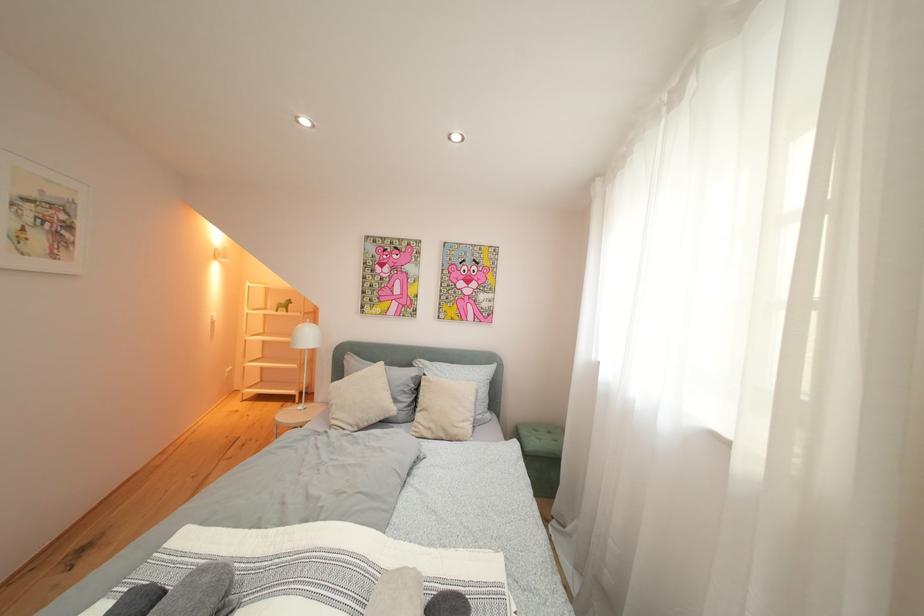
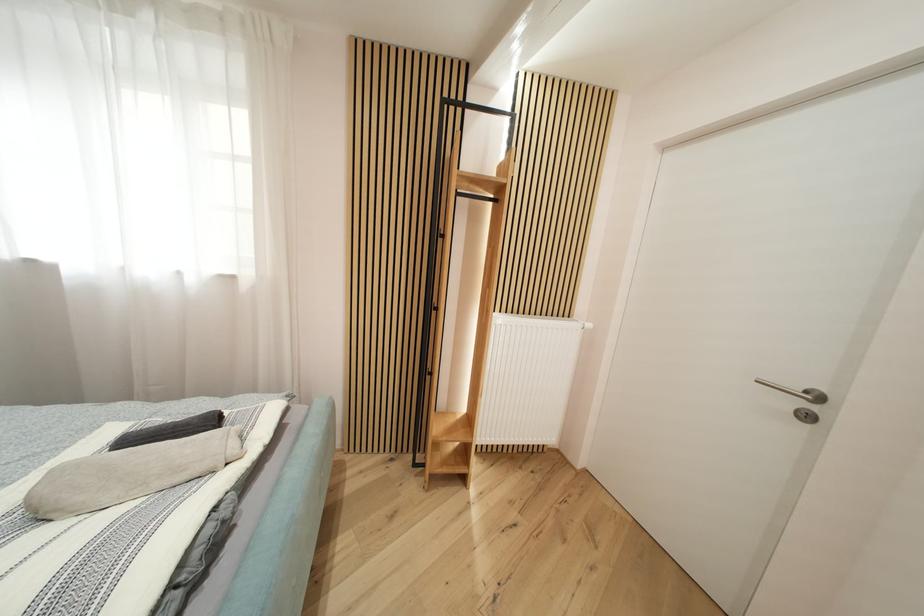
How did the camera likely rotate?

The camera rotated toward right-down.